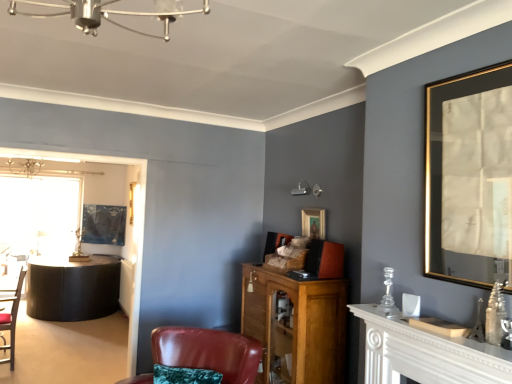
Question: Should I look upward or downward to see matte black picture frame at center, which is counted as the first picture frame, starting from the left?

Choices:
 (A) down
 (B) up

Answer: (A)

Question: Is the depth of leather armchair at center, marked as the second chair in a left-to-right arrangement, greater than that of gold-framed mirror at upper right, which is counted as the third picture frame, starting from the back?

Choices:
 (A) no
 (B) yes

Answer: (B)

Question: Is leather armchair at center, marked as the second chair in a left-to-right arrangement, aimed at gold-framed mirror at upper right, acting as the 1th picture frame starting from the right?

Choices:
 (A) no
 (B) yes

Answer: (A)

Question: Does leather armchair at center, which is counted as the second chair, starting from the back, have a greater width compared to gold-framed mirror at upper right, the 3th picture frame positioned from the left?

Choices:
 (A) no
 (B) yes

Answer: (B)

Question: Would you consider leather armchair at center, the first chair in the front-to-back sequence, to be distant from gold-framed mirror at upper right, acting as the 1th picture frame starting from the right?

Choices:
 (A) no
 (B) yes

Answer: (B)

Question: Does leather armchair at center, which is counted as the second chair, starting from the back, lie in front of gold-framed mirror at upper right, acting as the 1th picture frame starting from the right?

Choices:
 (A) yes
 (B) no

Answer: (B)

Question: Considering the relative sizes of leather armchair at center, marked as the second chair in a left-to-right arrangement, and gold-framed mirror at upper right, acting as the 1th picture frame starting from the right, in the image provided, is leather armchair at center, marked as the second chair in a left-to-right arrangement, taller than gold-framed mirror at upper right, acting as the 1th picture frame starting from the right,?

Choices:
 (A) no
 (B) yes

Answer: (A)

Question: From a real-world perspective, is matte black chair at left, placed as the 1th chair when sorted from left to right, located higher than wooden cabinet at center?

Choices:
 (A) yes
 (B) no

Answer: (B)

Question: Is matte black chair at left, placed as the 1th chair when sorted from left to right, oriented away from wooden cabinet at center?

Choices:
 (A) no
 (B) yes

Answer: (A)

Question: Considering the relative sizes of matte black chair at left, acting as the 1th chair starting from the back, and wooden cabinet at center in the image provided, is matte black chair at left, acting as the 1th chair starting from the back, smaller than wooden cabinet at center?

Choices:
 (A) no
 (B) yes

Answer: (B)

Question: Is wooden cabinet at center surrounded by matte black chair at left, positioned as the 2th chair in front-to-back order?

Choices:
 (A) yes
 (B) no

Answer: (B)

Question: From the image's perspective, does matte black chair at left, acting as the 1th chair starting from the back, appear higher than wooden cabinet at center?

Choices:
 (A) no
 (B) yes

Answer: (A)

Question: Is matte black chair at left, acting as the 1th chair starting from the back, directly adjacent to wooden cabinet at center?

Choices:
 (A) no
 (B) yes

Answer: (A)

Question: From the image's perspective, is white wooden mantelpiece at right beneath wooden cabinet at center?

Choices:
 (A) no
 (B) yes

Answer: (A)